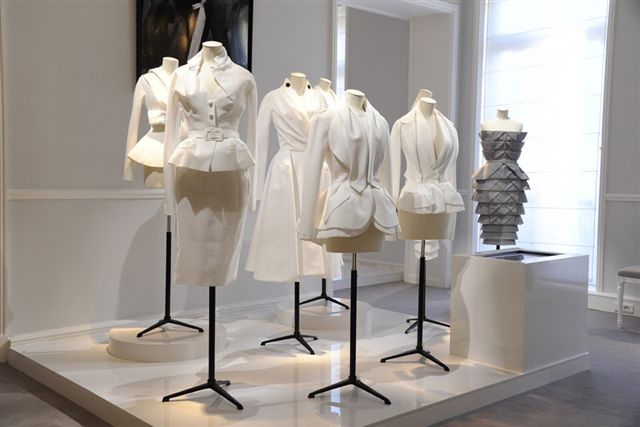
The width and height of the screenshot is (640, 427). Find the location of `table`. table is located at coordinates (548, 278).